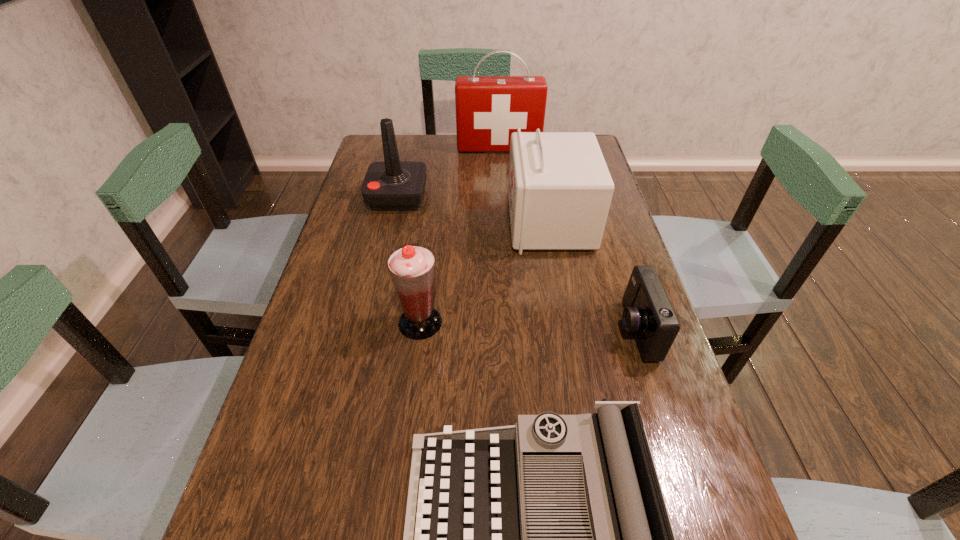
Locate an element on the screen. The width and height of the screenshot is (960, 540). free space at the left edge of the desktop is located at coordinates (385, 249).

Locate an element on the screen. The image size is (960, 540). vacant space at the right edge of the desktop is located at coordinates (627, 242).

The width and height of the screenshot is (960, 540). I want to click on vacant space that's between the taller first-aid kit and the joystick, so click(448, 172).

At what (x,y) coordinates should I click in order to perform the action: click on empty location between the camera and the smoothie. Please return your answer as a coordinate pair (x, y). The width and height of the screenshot is (960, 540). Looking at the image, I should click on pyautogui.click(x=528, y=326).

Identify the location of vacant area between the smoothie and the nearer first-aid kit. Image resolution: width=960 pixels, height=540 pixels. (485, 272).

The height and width of the screenshot is (540, 960). Find the location of `empty location between the tallest object and the joystick`. empty location between the tallest object and the joystick is located at coordinates tap(448, 172).

Where is `vacant area that lies between the camera and the smoothie`? This screenshot has height=540, width=960. vacant area that lies between the camera and the smoothie is located at coordinates (528, 326).

Where is `free space between the joystick and the camera`? The width and height of the screenshot is (960, 540). free space between the joystick and the camera is located at coordinates (516, 264).

Select which object appears as the third closest to the camera. Please provide its 2D coordinates. Your answer should be formatted as a tuple, i.e. [(x, y)], where the tuple contains the x and y coordinates of a point satisfying the conditions above.

[(412, 267)]

Image resolution: width=960 pixels, height=540 pixels. Find the location of `the second closest object to the camera`. the second closest object to the camera is located at coordinates (550, 539).